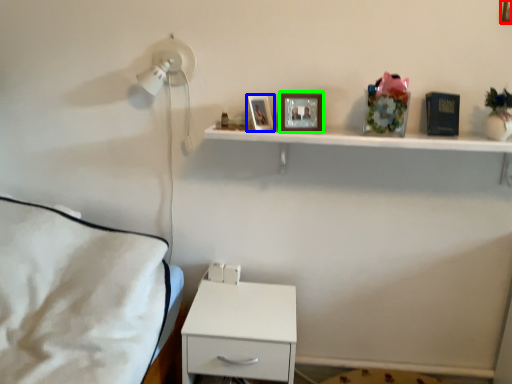
Question: Which object is positioned closest to picture frame (highlighted by a red box)? Select from picture frame (highlighted by a blue box) and picture frame (highlighted by a green box).

Choices:
 (A) picture frame
 (B) picture frame

Answer: (B)